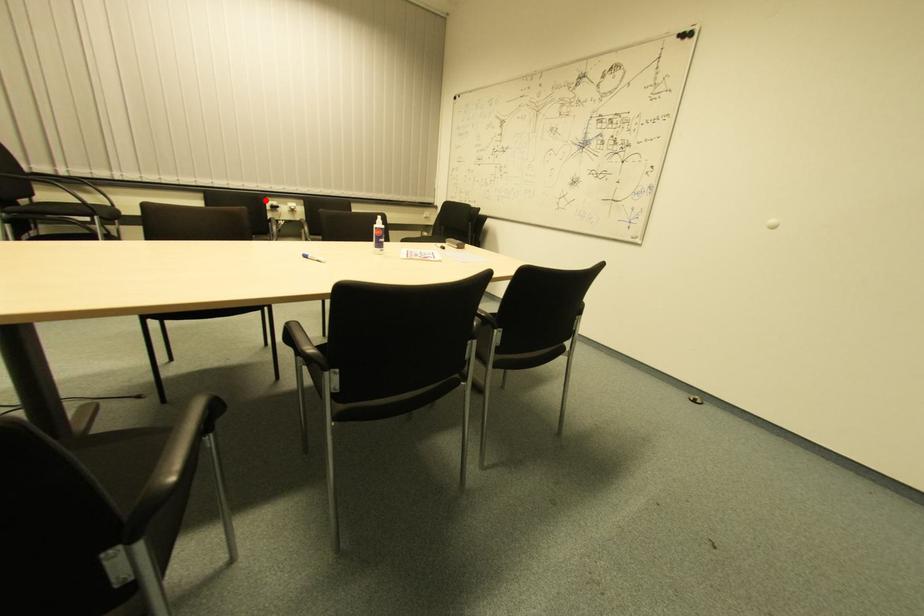
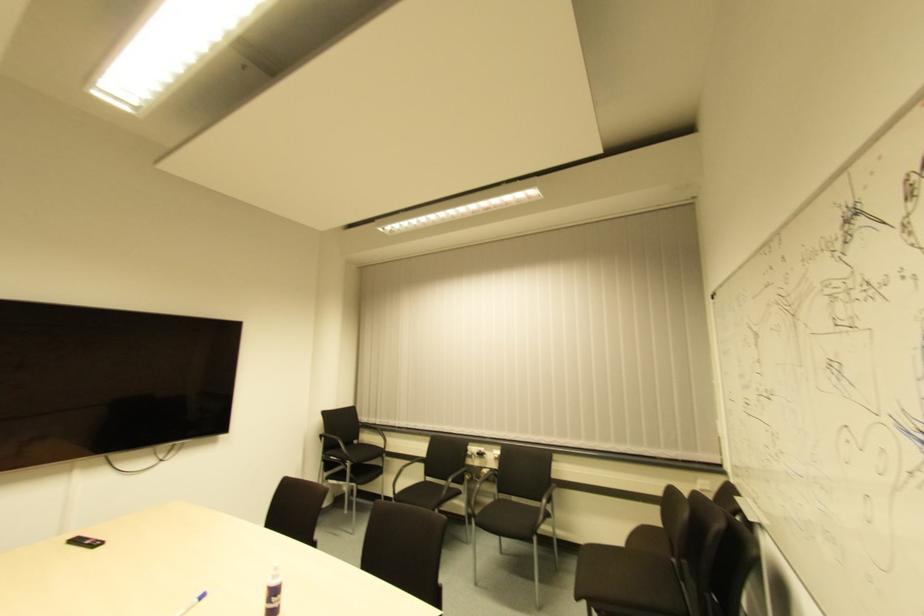
Question: I am providing you with two images of the same scene from different viewpoints. Image1 has a red point marked. In image2, the corresponding 3D location appears at what relative position? Reply with the corresponding letter.

Choices:
 (A) Closer
 (B) Farther

Answer: (B)